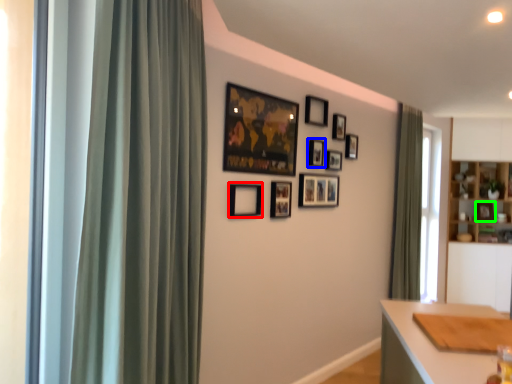
Question: Which object is the closest to the picture frame (highlighted by a red box)? Choose among these: picture frame (highlighted by a blue box) or picture frame (highlighted by a green box).

Choices:
 (A) picture frame
 (B) picture frame

Answer: (A)